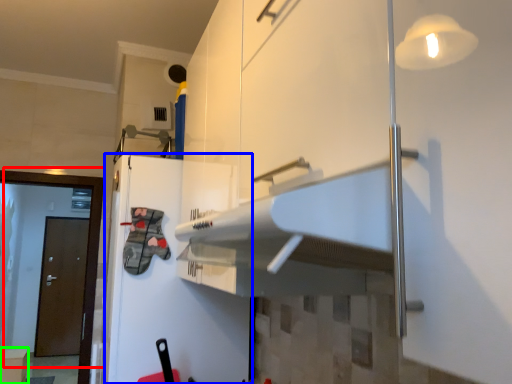
Question: Considering the real-world distances, which object is closest to door (highlighted by a red box)? fridge (highlighted by a blue box) or cabinetry (highlighted by a green box).

Choices:
 (A) fridge
 (B) cabinetry

Answer: (A)